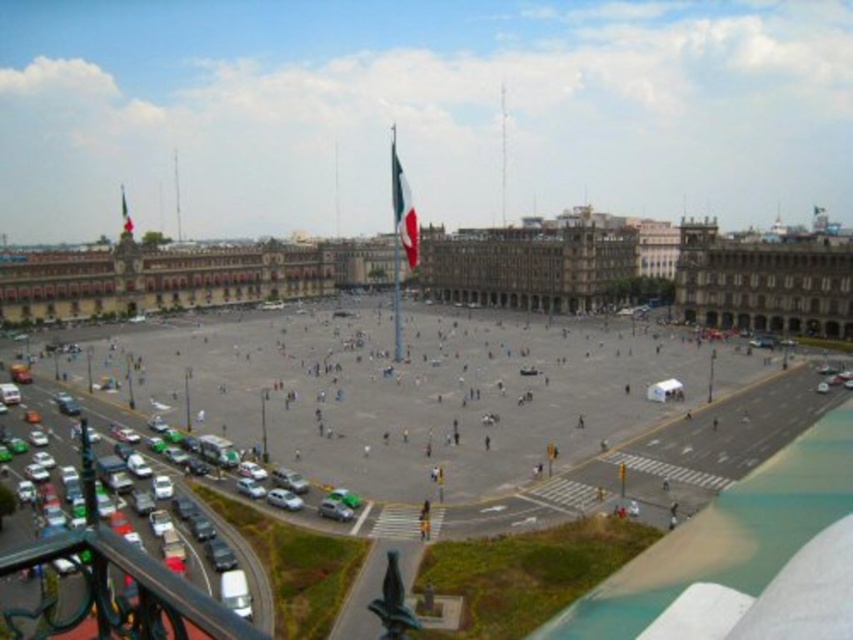
You are standing on the balcony overlooking the plaza and want to walk down to the smooth concrete plaza at center. Which direction should you go relative to the red fabric flag at center?

You should go to the left of the red fabric flag at center because the smooth concrete plaza at center is located to its left.

You are standing on a balcony overlooking the plaza and want to take a photo of both the brown stone building at center and the green fabric flag at upper center. Which object should you frame first in your camera to ensure both are in the shot?

You should frame the green fabric flag at upper center first because the brown stone building at center is positioned to its right, so starting with the flag ensures both are included in the shot.